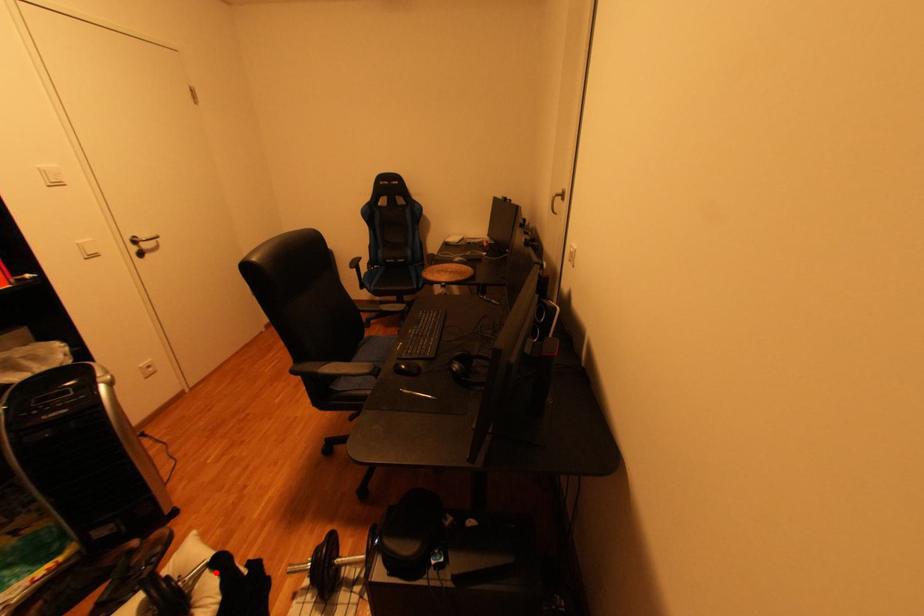
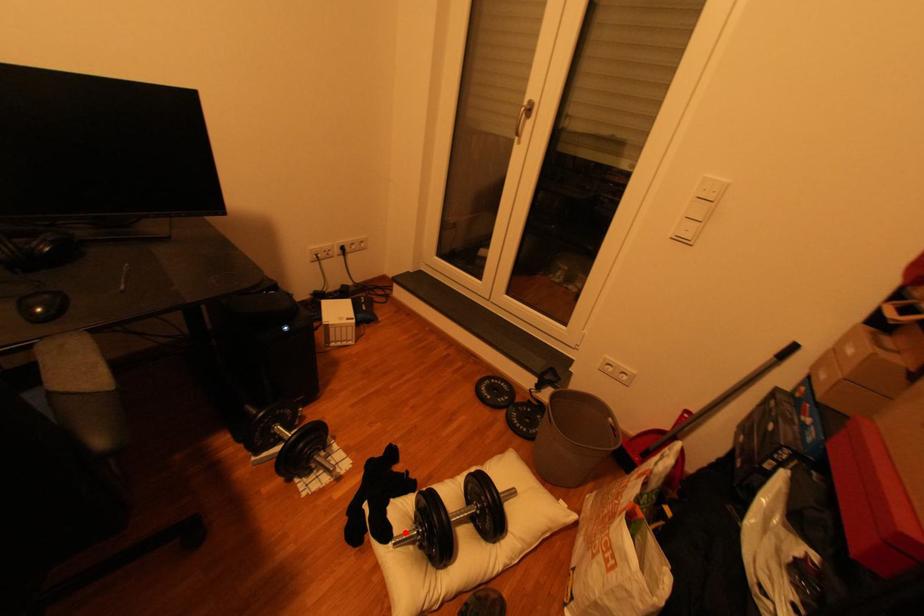
I am providing you with two images of the same scene from different viewpoints. A red point is marked on the first image and another point is marked on the second image. Is the red point in image1 aligned with the point shown in image2?

Yes